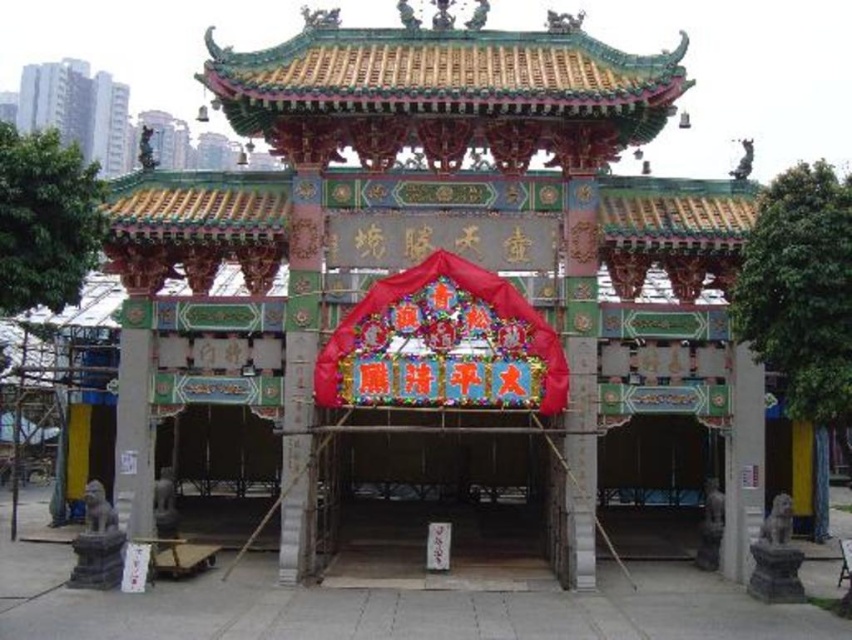
Question: Can you confirm if multicolored painted wooden gazebo at center is bigger than shiny red fabric canopy at center?

Choices:
 (A) yes
 (B) no

Answer: (A)

Question: Which point is farther from the camera taking this photo?

Choices:
 (A) (337, 492)
 (B) (481, 436)
 (C) (318, 381)

Answer: (B)

Question: Which point is closer to the camera?

Choices:
 (A) (308, 227)
 (B) (350, 529)
 (C) (545, 412)

Answer: (C)

Question: Considering the real-world distances, which object is farthest from the shiny red fabric canopy at center?

Choices:
 (A) multicolored painted wooden gazebo at center
 (B) wooden gate at center

Answer: (B)

Question: Observing the image, what is the correct spatial positioning of multicolored painted wooden gazebo at center in reference to shiny red fabric canopy at center?

Choices:
 (A) right
 (B) left

Answer: (B)

Question: Where is multicolored painted wooden gazebo at center located in relation to shiny red fabric canopy at center in the image?

Choices:
 (A) left
 (B) right

Answer: (A)